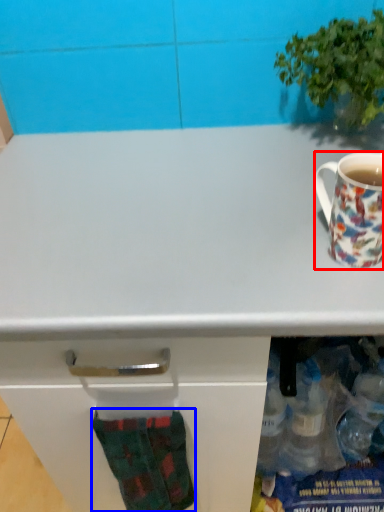
Question: Which object is further to the camera taking this photo, coffee cup (highlighted by a red box) or sock (highlighted by a blue box)?

Choices:
 (A) coffee cup
 (B) sock

Answer: (B)